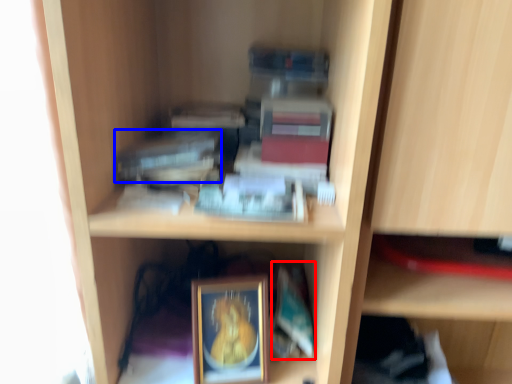
Question: Which of the following is the farthest to the observer, paperback book (highlighted by a red box) or paperback book (highlighted by a blue box)?

Choices:
 (A) paperback book
 (B) paperback book

Answer: (A)